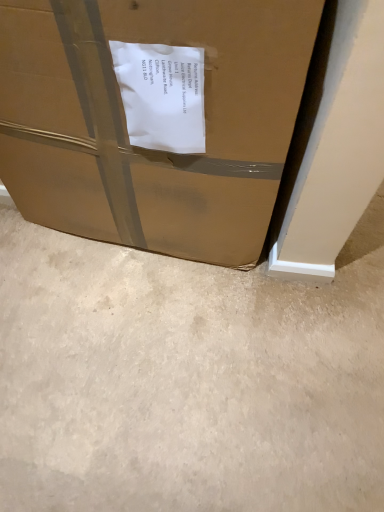
Question: Is point (331, 438) positioned closer to the camera than point (145, 188)?

Choices:
 (A) closer
 (B) farther

Answer: (B)

Question: Considering the relative positions of beige carpet at lower center and brown cardboard box at lower left in the image provided, is beige carpet at lower center to the left or to the right of brown cardboard box at lower left?

Choices:
 (A) right
 (B) left

Answer: (A)

Question: From a real-world perspective, is beige carpet at lower center physically located above or below brown cardboard box at lower left?

Choices:
 (A) below
 (B) above

Answer: (A)

Question: Is brown cardboard box at lower left in front of or behind beige carpet at lower center in the image?

Choices:
 (A) behind
 (B) front

Answer: (B)

Question: From a real-world perspective, is brown cardboard box at lower left above or below beige carpet at lower center?

Choices:
 (A) below
 (B) above

Answer: (B)

Question: Based on their sizes in the image, would you say brown cardboard box at lower left is bigger or smaller than beige carpet at lower center?

Choices:
 (A) small
 (B) big

Answer: (B)

Question: Visually, is brown cardboard box at lower left positioned to the left or to the right of beige carpet at lower center?

Choices:
 (A) right
 (B) left

Answer: (B)